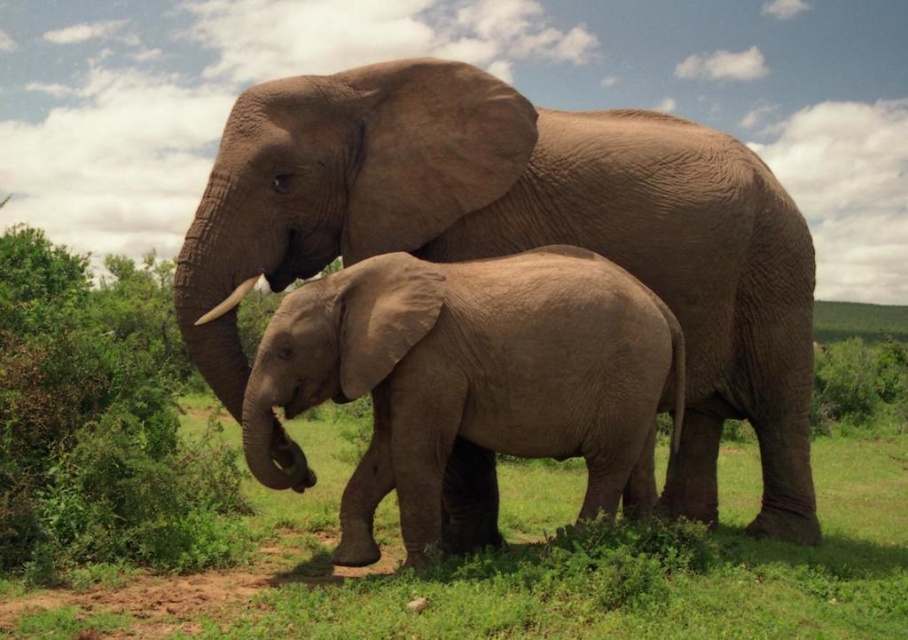
You are standing in front of the elephants and want to place a small flower at two specific points in the image. The first point is at coordinates point (222, 308), and the second is at point (416, 417). Which point will appear larger in your view?

Point (222, 308) is closer to the viewer than point (416, 417), so it will appear larger in your view.

You are observing two elephants in a natural setting. You notice a matte brown elephant at center and a smooth gray elephant at center. Which one is positioned to the right of the other?

The matte brown elephant at center is positioned to the right of the smooth gray elephant at center.

You are standing at the origin point of the image coordinate system. Where is the matte brown elephant at center located in terms of coordinates?

The matte brown elephant at center is located at point coordinates of (524,236).